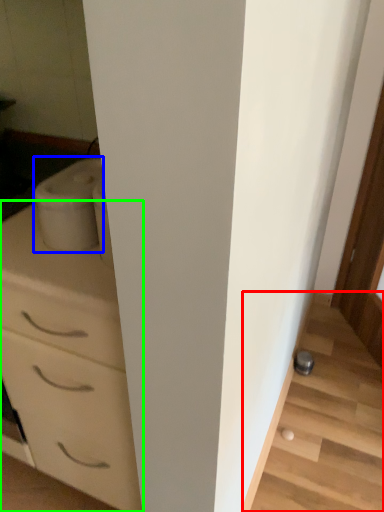
Question: Which is farther away from stairwell (highlighted by a red box)? appliance (highlighted by a blue box) or chest of drawers (highlighted by a green box)?

Choices:
 (A) appliance
 (B) chest of drawers

Answer: (A)